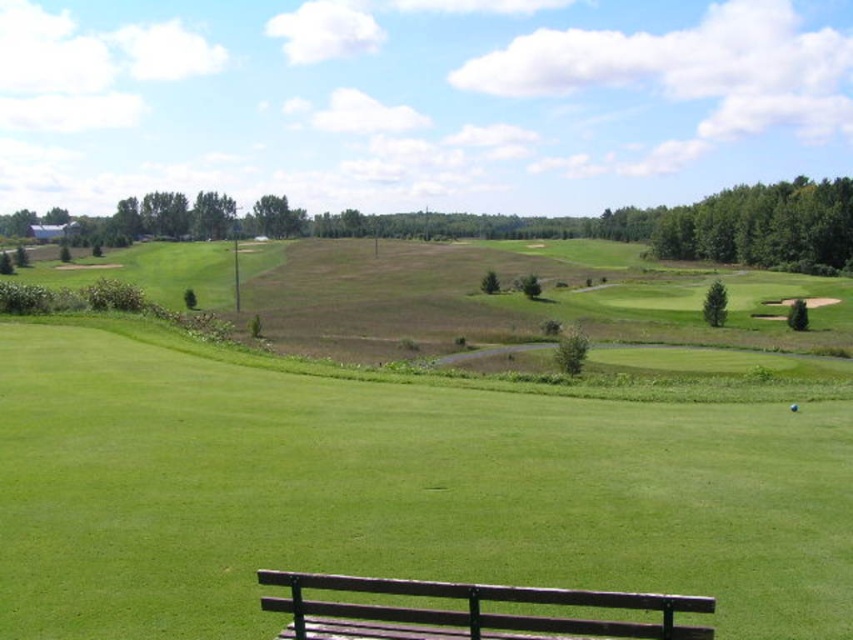
Question: Is green grassy field at center closer to the viewer compared to brown wooden bench at lower center?

Choices:
 (A) no
 (B) yes

Answer: (A)

Question: Does green grassy field at center have a smaller size compared to brown wooden bench at lower center?

Choices:
 (A) yes
 (B) no

Answer: (B)

Question: Which object is farther from the camera taking this photo?

Choices:
 (A) brown wooden bench at lower center
 (B) green grassy field at center

Answer: (B)

Question: Which point is closer to the camera?

Choices:
 (A) (270, 548)
 (B) (462, 612)

Answer: (B)

Question: Can you confirm if green grassy field at center is bigger than brown wooden bench at lower center?

Choices:
 (A) yes
 (B) no

Answer: (A)